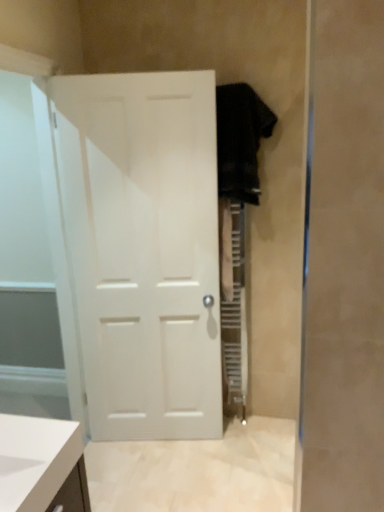
Question: Should I look upward or downward to see transparent glass door at left?

Choices:
 (A) up
 (B) down

Answer: (B)

Question: From a real-world perspective, is black fabric robe at right positioned under transparent glass door at left based on gravity?

Choices:
 (A) no
 (B) yes

Answer: (A)

Question: Is black fabric robe at right bigger than transparent glass door at left?

Choices:
 (A) yes
 (B) no

Answer: (B)

Question: From the image's perspective, is black fabric robe at right below transparent glass door at left?

Choices:
 (A) no
 (B) yes

Answer: (A)

Question: Is black fabric robe at right facing towards transparent glass door at left?

Choices:
 (A) no
 (B) yes

Answer: (A)

Question: From a real-world perspective, is black fabric robe at right positioned over transparent glass door at left based on gravity?

Choices:
 (A) yes
 (B) no

Answer: (A)

Question: Is black fabric robe at right further to camera compared to transparent glass door at left?

Choices:
 (A) no
 (B) yes

Answer: (B)

Question: Can you confirm if white matte door at center is wider than black fabric robe at right?

Choices:
 (A) yes
 (B) no

Answer: (B)

Question: Can you confirm if white matte door at center is bigger than black fabric robe at right?

Choices:
 (A) no
 (B) yes

Answer: (B)

Question: Is black fabric robe at right a part of white matte door at center?

Choices:
 (A) no
 (B) yes

Answer: (A)

Question: Can you confirm if white matte door at center is taller than black fabric robe at right?

Choices:
 (A) yes
 (B) no

Answer: (A)

Question: Is white matte door at center positioned far away from black fabric robe at right?

Choices:
 (A) no
 (B) yes

Answer: (A)

Question: From a real-world perspective, does white matte door at center sit lower than black fabric robe at right?

Choices:
 (A) yes
 (B) no

Answer: (A)

Question: Considering the relative positions of transparent glass door at left and white matte door at center in the image provided, is transparent glass door at left to the left of white matte door at center from the viewer's perspective?

Choices:
 (A) no
 (B) yes

Answer: (B)